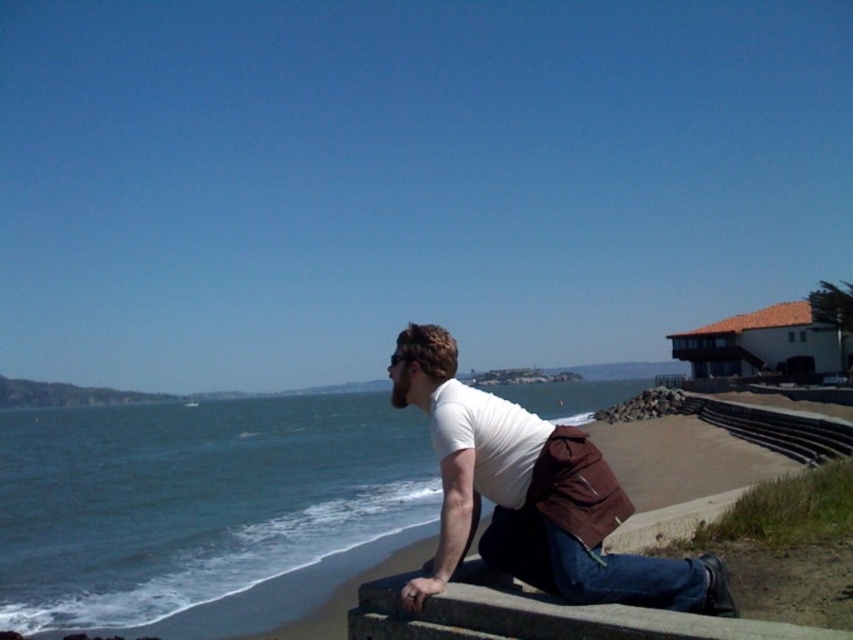
Can you confirm if blue water at lower left is positioned to the left of blue denim jeans at lower center?

Correct, you'll find blue water at lower left to the left of blue denim jeans at lower center.

Can you confirm if blue water at lower left is positioned to the right of blue denim jeans at lower center?

Incorrect, blue water at lower left is not on the right side of blue denim jeans at lower center.

Is point (427, 470) more distant than point (563, 534)?

Yes.

Identify the location of blue water at lower left. This screenshot has width=853, height=640. (202, 509).

Does blue water at lower left come behind white matte shirt at center?

Yes, it is behind white matte shirt at center.

Is the position of blue water at lower left less distant than that of white matte shirt at center?

That is False.

The image size is (853, 640). What do you see at coordinates (202, 509) in the screenshot?
I see `blue water at lower left` at bounding box center [202, 509].

Locate an element on the screen. blue water at lower left is located at coordinates (202, 509).

Who is taller, white matte shirt at center or blue denim jeans at lower center?

With more height is white matte shirt at center.

Can you confirm if white matte shirt at center is wider than blue denim jeans at lower center?

Yes, white matte shirt at center is wider than blue denim jeans at lower center.

Does point (505, 428) come closer to viewer compared to point (549, 588)?

No, it is not.

Find the location of `white matte shirt at center`. white matte shirt at center is located at coordinates (531, 497).